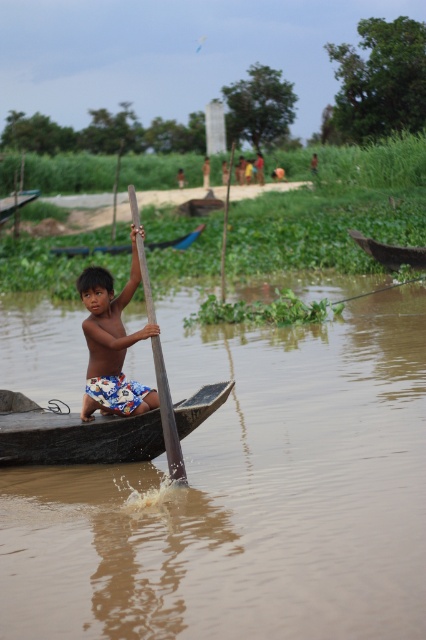
How far apart are wooden smooth paddle at center and brown wooden boat at right?

wooden smooth paddle at center is 12.99 meters from brown wooden boat at right.

Find the location of `wooden smooth paddle at center`. wooden smooth paddle at center is located at coordinates (167, 416).

Can you confirm if dark brown wood canoe at center is positioned to the right of wooden smooth paddle at center?

No, dark brown wood canoe at center is not to the right of wooden smooth paddle at center.

Is dark brown wood canoe at center below wooden smooth paddle at center?

Yes.

Does point (201, 410) come farther from viewer compared to point (143, 285)?

No, (201, 410) is in front of (143, 285).

Where is `dark brown wood canoe at center`? dark brown wood canoe at center is located at coordinates (78, 438).

Is point (411, 259) in front of point (160, 244)?

That is True.

Is brown wooden boat at right shorter than blue fabric boat at center?

Correct, brown wooden boat at right is not as tall as blue fabric boat at center.

The image size is (426, 640). Identify the location of brown wooden boat at right. (391, 252).